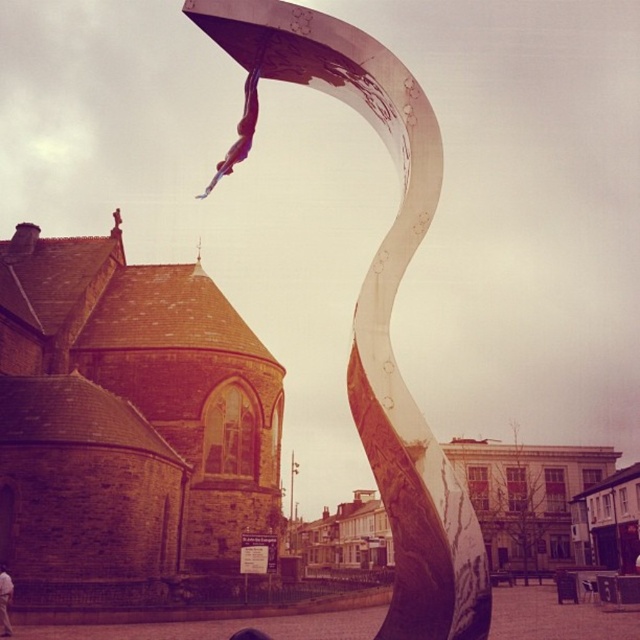
Does metallic polished sculpture at center have a smaller size compared to white cotton shirt at lower left?

No.

Which is below, metallic polished sculpture at center or white cotton shirt at lower left?

white cotton shirt at lower left

Is point (428, 500) farther from camera compared to point (4, 600)?

That is False.

Locate an element on the screen. The height and width of the screenshot is (640, 640). metallic polished sculpture at center is located at coordinates (381, 308).